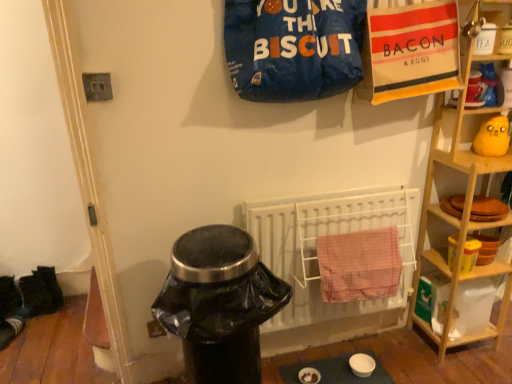
Question: Does black fabric shoes at lower left, the 1th footwear when ordered from top to bottom, appear on the right side of blue fabric sack at upper center?

Choices:
 (A) no
 (B) yes

Answer: (A)

Question: From a real-world perspective, is black fabric shoes at lower left, marked as the second footwear in a front-to-back arrangement, on top of blue fabric sack at upper center?

Choices:
 (A) no
 (B) yes

Answer: (A)

Question: Is blue fabric sack at upper center located within black fabric shoes at lower left, placed as the second footwear when sorted from bottom to top?

Choices:
 (A) no
 (B) yes

Answer: (A)

Question: Is black fabric shoes at lower left, placed as the first footwear when sorted from back to front, not inside blue fabric sack at upper center?

Choices:
 (A) no
 (B) yes

Answer: (B)

Question: Considering the relative sizes of black fabric shoes at lower left, marked as the second footwear in a front-to-back arrangement, and blue fabric sack at upper center in the image provided, is black fabric shoes at lower left, marked as the second footwear in a front-to-back arrangement, shorter than blue fabric sack at upper center?

Choices:
 (A) yes
 (B) no

Answer: (A)

Question: Is black fabric shoes at lower left, placed as the first footwear when sorted from back to front, directly adjacent to blue fabric sack at upper center?

Choices:
 (A) yes
 (B) no

Answer: (B)

Question: Is matte blue table at lower center looking in the opposite direction of white metal radiator at center?

Choices:
 (A) no
 (B) yes

Answer: (A)

Question: Does matte blue table at lower center have a greater width compared to white metal radiator at center?

Choices:
 (A) no
 (B) yes

Answer: (B)

Question: Is matte blue table at lower center beside white metal radiator at center?

Choices:
 (A) yes
 (B) no

Answer: (B)

Question: Can you confirm if matte blue table at lower center is shorter than white metal radiator at center?

Choices:
 (A) yes
 (B) no

Answer: (A)

Question: Is matte blue table at lower center aimed at white metal radiator at center?

Choices:
 (A) yes
 (B) no

Answer: (B)

Question: Is matte blue table at lower center behind white metal radiator at center?

Choices:
 (A) no
 (B) yes

Answer: (B)

Question: Is black fabric shoes at lower left, the 1th footwear when ordered from top to bottom, in contact with wooden shelf at right?

Choices:
 (A) yes
 (B) no

Answer: (B)